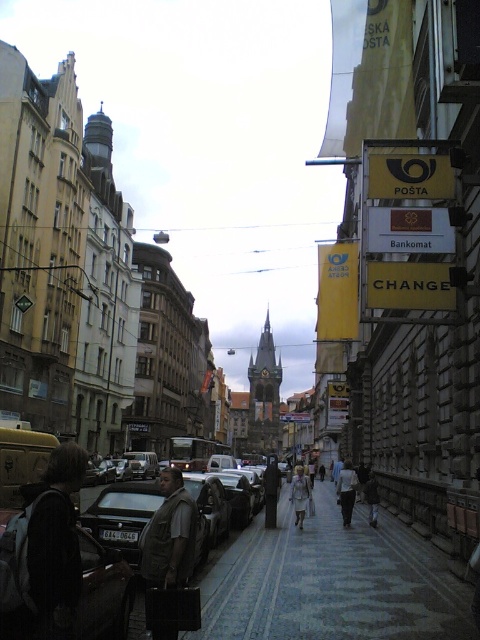
Can you confirm if paved stone sidewalk at center is thinner than brown fabric backpack at center?

No, paved stone sidewalk at center is not thinner than brown fabric backpack at center.

Is point (288, 600) positioned behind point (167, 504)?

Yes, it is behind point (167, 504).

Who is more forward, (266, 628) or (188, 556)?

Point (266, 628) is in front.

At what (x,y) coordinates should I click in order to perform the action: click on paved stone sidewalk at center. Please return your answer as a coordinate pair (x, y). The image size is (480, 640). Looking at the image, I should click on (332, 582).

Does light beige pants at center have a lesser height compared to light gray fabric dress at center?

Yes.

Does light beige pants at center have a lesser width compared to light gray fabric dress at center?

No.

Identify the location of light beige pants at center. (347, 492).

The image size is (480, 640). I want to click on light beige pants at center, so click(347, 492).

Who is taller, light beige pants at center or dark gray jacket at center?

With more height is light beige pants at center.

Is point (342, 472) less distant than point (362, 490)?

Yes, point (342, 472) is in front of point (362, 490).

Where is `light beige pants at center`? Image resolution: width=480 pixels, height=640 pixels. light beige pants at center is located at coordinates (x=347, y=492).